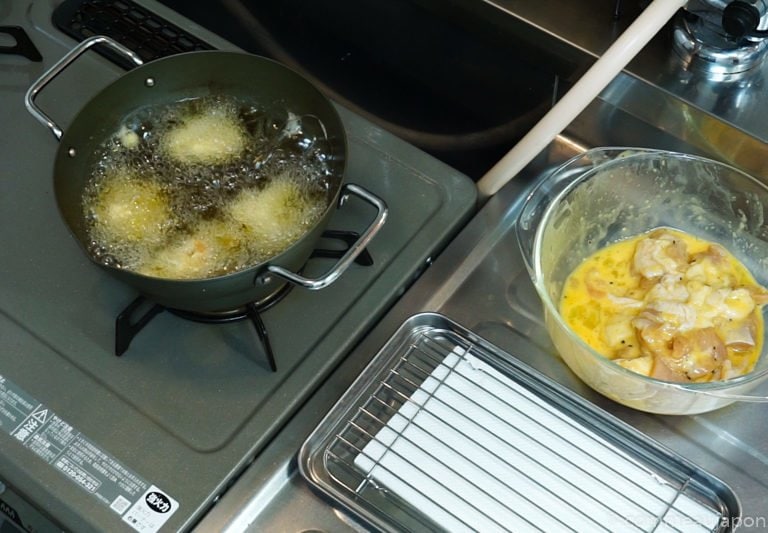
Identify the location of silver rack inside silver tray pan. click(402, 395).